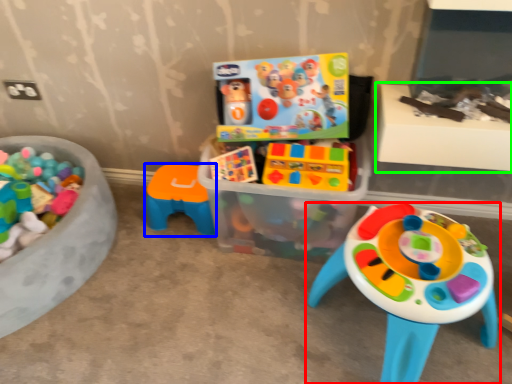
Question: Considering the real-world distances, which object is farthest from toy (highlighted by a red box)? toy (highlighted by a blue box) or table (highlighted by a green box)?

Choices:
 (A) toy
 (B) table

Answer: (A)